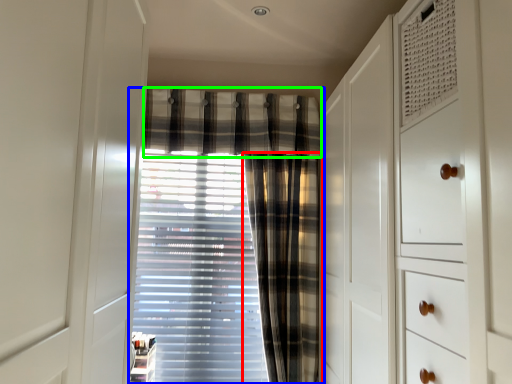
Question: Which object is the closest to the curtain (highlighted by a red box)? Choose among these: curtain (highlighted by a blue box) or plaid (highlighted by a green box).

Choices:
 (A) curtain
 (B) plaid

Answer: (A)